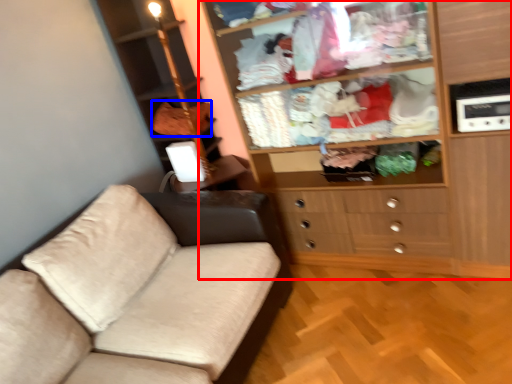
Question: Which of the following is the closest to the observer, cupboard (highlighted by a red box) or clothing (highlighted by a blue box)?

Choices:
 (A) cupboard
 (B) clothing

Answer: (A)